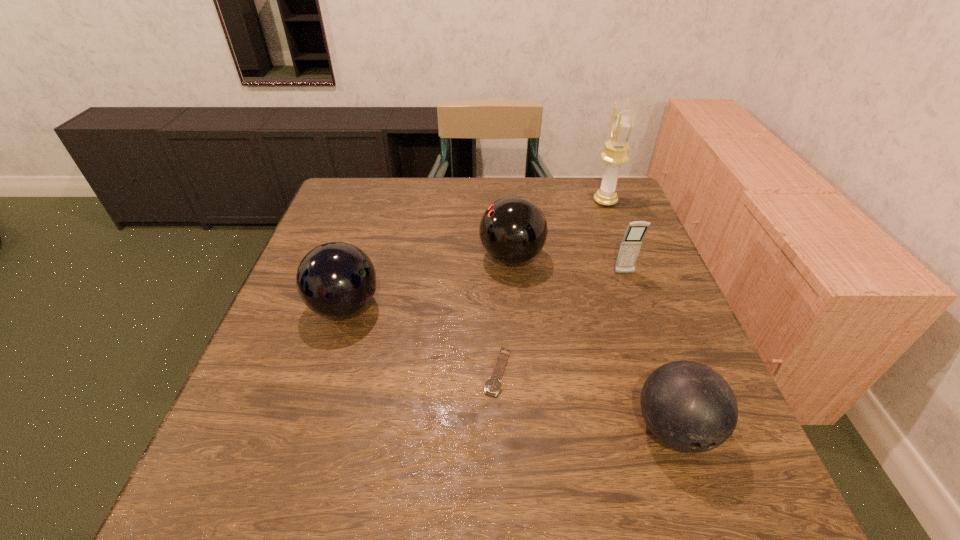
Locate an element on the screen. This screenshot has width=960, height=540. vacant space that satisfies the following two spatial constraints: 1. on the front-facing side of the cellular telephone; 2. on the side of the fourth farthest object with the finger holes is located at coordinates (636, 307).